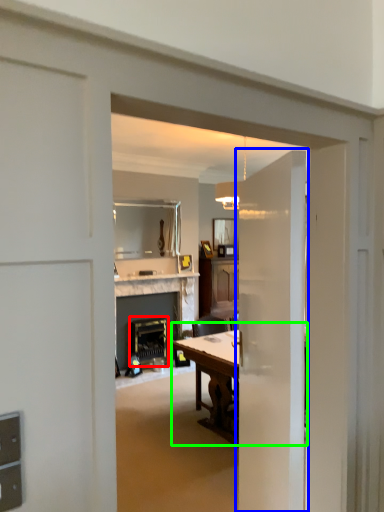
Question: Which object is the closest to the appliance (highlighted by a red box)? Choose among these: door (highlighted by a blue box) or table (highlighted by a green box).

Choices:
 (A) door
 (B) table

Answer: (B)